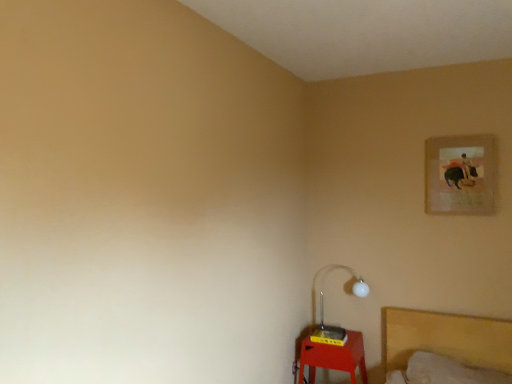
Question: Is matte paper picture frame at upper right further to camera compared to yellow plastic table at lower right?

Choices:
 (A) yes
 (B) no

Answer: (B)

Question: Does matte paper picture frame at upper right touch yellow plastic table at lower right?

Choices:
 (A) no
 (B) yes

Answer: (A)

Question: Is matte paper picture frame at upper right bigger than yellow plastic table at lower right?

Choices:
 (A) yes
 (B) no

Answer: (B)

Question: From the image's perspective, would you say matte paper picture frame at upper right is positioned over yellow plastic table at lower right?

Choices:
 (A) yes
 (B) no

Answer: (A)

Question: Does matte paper picture frame at upper right have a greater width compared to yellow plastic table at lower right?

Choices:
 (A) no
 (B) yes

Answer: (A)

Question: From the image's perspective, does matte paper picture frame at upper right appear lower than yellow plastic table at lower right?

Choices:
 (A) yes
 (B) no

Answer: (B)

Question: Considering the relative positions of yellow plastic table at lower right and white glossy lamp at lower right in the image provided, is yellow plastic table at lower right behind white glossy lamp at lower right?

Choices:
 (A) no
 (B) yes

Answer: (A)

Question: Is yellow plastic table at lower right looking in the opposite direction of white glossy lamp at lower right?

Choices:
 (A) yes
 (B) no

Answer: (B)

Question: Is yellow plastic table at lower right outside of white glossy lamp at lower right?

Choices:
 (A) yes
 (B) no

Answer: (A)

Question: From a real-world perspective, is yellow plastic table at lower right on top of white glossy lamp at lower right?

Choices:
 (A) no
 (B) yes

Answer: (A)

Question: Is yellow plastic table at lower right next to white glossy lamp at lower right?

Choices:
 (A) no
 (B) yes

Answer: (A)

Question: Is yellow plastic table at lower right not close to white glossy lamp at lower right?

Choices:
 (A) yes
 (B) no

Answer: (B)

Question: Is matte paper picture frame at upper right surrounded by yellow plastic table at lower right?

Choices:
 (A) yes
 (B) no

Answer: (B)